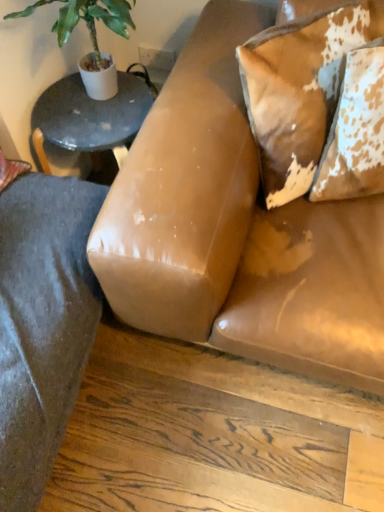
What is the approximate width of green leafy plant at upper left?

It is 15.30 inches.

Consider the image. What is the approximate width of leather couch at center?

leather couch at center is 1.00 meters wide.

This screenshot has height=512, width=384. Identify the location of speckled leather pillow at upper right, the 2th pillow viewed from the right. (297, 92).

Does speckled leather pillow at upper right, marked as the 1th pillow in a left-to-right arrangement, come in front of green leafy plant at upper left?

Yes, speckled leather pillow at upper right, marked as the 1th pillow in a left-to-right arrangement, is in front of green leafy plant at upper left.

Who is smaller, speckled leather pillow at upper right, the 2th pillow viewed from the right, or green leafy plant at upper left?

With smaller size is green leafy plant at upper left.

Is speckled leather pillow at upper right, marked as the 1th pillow in a left-to-right arrangement, oriented towards green leafy plant at upper left?

No.

From a real-world perspective, which is physically above, brown cowhide pillow at upper right, placed as the 1th pillow when sorted from right to left, or leather couch at center?

brown cowhide pillow at upper right, placed as the 1th pillow when sorted from right to left.

Can you confirm if brown cowhide pillow at upper right, arranged as the second pillow when viewed from the left, is positioned to the left of leather couch at center?

No.

In terms of width, does brown cowhide pillow at upper right, arranged as the second pillow when viewed from the left, look wider or thinner when compared to leather couch at center?

In the image, brown cowhide pillow at upper right, arranged as the second pillow when viewed from the left, appears to be more narrow than leather couch at center.

Which is behind, leather couch at center or speckled leather pillow at upper right, the 2th pillow viewed from the right?

speckled leather pillow at upper right, the 2th pillow viewed from the right.

Is speckled leather pillow at upper right, marked as the 1th pillow in a left-to-right arrangement, at the back of leather couch at center?

Absolutely, leather couch at center is directed away from speckled leather pillow at upper right, marked as the 1th pillow in a left-to-right arrangement.

From a real-world perspective, which object rests below the other?

leather couch at center is physically lower.

Who is smaller, leather couch at center or speckled leather pillow at upper right, marked as the 1th pillow in a left-to-right arrangement?

Smaller between the two is speckled leather pillow at upper right, marked as the 1th pillow in a left-to-right arrangement.

Who is more distant, green leafy plant at upper left or brown cowhide pillow at upper right, arranged as the second pillow when viewed from the left?

green leafy plant at upper left is behind.

From a real-world perspective, is green leafy plant at upper left above or below brown cowhide pillow at upper right, arranged as the second pillow when viewed from the left?

From a real-world perspective, green leafy plant at upper left is physically above brown cowhide pillow at upper right, arranged as the second pillow when viewed from the left.

Is green leafy plant at upper left far from brown cowhide pillow at upper right, placed as the 1th pillow when sorted from right to left?

No, there isn't a large distance between green leafy plant at upper left and brown cowhide pillow at upper right, placed as the 1th pillow when sorted from right to left.

Can you confirm if green leafy plant at upper left is bigger than brown cowhide pillow at upper right, placed as the 1th pillow when sorted from right to left?

Yes, green leafy plant at upper left is bigger than brown cowhide pillow at upper right, placed as the 1th pillow when sorted from right to left.

Is speckled leather pillow at upper right, the 2th pillow viewed from the right, far away from brown cowhide pillow at upper right, arranged as the second pillow when viewed from the left?

No.

From a real-world perspective, does speckled leather pillow at upper right, marked as the 1th pillow in a left-to-right arrangement, stand above brown cowhide pillow at upper right, placed as the 1th pillow when sorted from right to left?

No.

Between speckled leather pillow at upper right, marked as the 1th pillow in a left-to-right arrangement, and brown cowhide pillow at upper right, arranged as the second pillow when viewed from the left, which one has smaller width?

brown cowhide pillow at upper right, arranged as the second pillow when viewed from the left, is thinner.

Can you tell me how much speckled leather pillow at upper right, marked as the 1th pillow in a left-to-right arrangement, and brown cowhide pillow at upper right, arranged as the second pillow when viewed from the left, differ in facing direction?

The angle between the facing direction of speckled leather pillow at upper right, marked as the 1th pillow in a left-to-right arrangement, and the facing direction of brown cowhide pillow at upper right, arranged as the second pillow when viewed from the left, is 7.68 degrees.

What's the angular difference between brown cowhide pillow at upper right, placed as the 1th pillow when sorted from right to left, and green leafy plant at upper left's facing directions?

32.7 degrees.

The height and width of the screenshot is (512, 384). What are the coordinates of `houseplant behind the brown cowhide pillow at upper right, placed as the 1th pillow when sorted from right to left` in the screenshot? It's located at (90, 37).

Consider the image. Is green leafy plant at upper left a part of brown cowhide pillow at upper right, arranged as the second pillow when viewed from the left?

Actually, green leafy plant at upper left is outside brown cowhide pillow at upper right, arranged as the second pillow when viewed from the left.

Can you confirm if brown cowhide pillow at upper right, arranged as the second pillow when viewed from the left, is taller than green leafy plant at upper left?

In fact, brown cowhide pillow at upper right, arranged as the second pillow when viewed from the left, may be shorter than green leafy plant at upper left.

From the image's perspective, would you say speckled leather pillow at upper right, the 2th pillow viewed from the right, is shown under leather couch at center?

Actually, speckled leather pillow at upper right, the 2th pillow viewed from the right, appears above leather couch at center in the image.

Is speckled leather pillow at upper right, the 2th pillow viewed from the right, not within leather couch at center?

No, speckled leather pillow at upper right, the 2th pillow viewed from the right, is not entirely external to leather couch at center.

Does speckled leather pillow at upper right, the 2th pillow viewed from the right, turn towards leather couch at center?

Yes, speckled leather pillow at upper right, the 2th pillow viewed from the right, is aimed at leather couch at center.

Does speckled leather pillow at upper right, marked as the 1th pillow in a left-to-right arrangement, lie in front of leather couch at center?

No, speckled leather pillow at upper right, marked as the 1th pillow in a left-to-right arrangement, is further to the viewer.

You are a GUI agent. You are given a task and a screenshot of the screen. Output one action in this format:
    pyautogui.click(x=<x>, y=<y>)
    Task: Click on the houseplant to the left of speckled leather pillow at upper right, marked as the 1th pillow in a left-to-right arrangement
    
    Given the screenshot: What is the action you would take?
    pyautogui.click(x=90, y=37)

From the image's perspective, which pillow is the 1st one above the leather couch at center? Please provide its 2D coordinates.

[(355, 131)]

Considering their positions, is green leafy plant at upper left positioned further to leather couch at center than speckled leather pillow at upper right, marked as the 1th pillow in a left-to-right arrangement?

The object further to leather couch at center is green leafy plant at upper left.

Based on their spatial positions, is leather couch at center or speckled leather pillow at upper right, marked as the 1th pillow in a left-to-right arrangement, further from green leafy plant at upper left?

Based on the image, leather couch at center appears to be further to green leafy plant at upper left.

When comparing their distances from speckled leather pillow at upper right, the 2th pillow viewed from the right, does brown cowhide pillow at upper right, placed as the 1th pillow when sorted from right to left, or green leafy plant at upper left seem closer?

brown cowhide pillow at upper right, placed as the 1th pillow when sorted from right to left.

When comparing their distances from green leafy plant at upper left, does speckled leather pillow at upper right, marked as the 1th pillow in a left-to-right arrangement, or brown cowhide pillow at upper right, placed as the 1th pillow when sorted from right to left, seem closer?

Among the two, speckled leather pillow at upper right, marked as the 1th pillow in a left-to-right arrangement, is located nearer to green leafy plant at upper left.

Estimate the real-world distances between objects in this image. Which object is further from speckled leather pillow at upper right, marked as the 1th pillow in a left-to-right arrangement, green leafy plant at upper left or brown cowhide pillow at upper right, placed as the 1th pillow when sorted from right to left?

green leafy plant at upper left lies further to speckled leather pillow at upper right, marked as the 1th pillow in a left-to-right arrangement, than the other object.

When comparing their distances from brown cowhide pillow at upper right, placed as the 1th pillow when sorted from right to left, does green leafy plant at upper left or speckled leather pillow at upper right, marked as the 1th pillow in a left-to-right arrangement, seem closer?

speckled leather pillow at upper right, marked as the 1th pillow in a left-to-right arrangement, is closer to brown cowhide pillow at upper right, placed as the 1th pillow when sorted from right to left.

When comparing their distances from speckled leather pillow at upper right, marked as the 1th pillow in a left-to-right arrangement, does green leafy plant at upper left or leather couch at center seem closer?

leather couch at center is positioned closer to the anchor speckled leather pillow at upper right, marked as the 1th pillow in a left-to-right arrangement.

When comparing their distances from brown cowhide pillow at upper right, arranged as the second pillow when viewed from the left, does leather couch at center or green leafy plant at upper left seem further?

green leafy plant at upper left is positioned further to the anchor brown cowhide pillow at upper right, arranged as the second pillow when viewed from the left.

Find the location of a particular element. The width and height of the screenshot is (384, 512). pillow between green leafy plant at upper left and brown cowhide pillow at upper right, placed as the 1th pillow when sorted from right to left, from left to right is located at coordinates (297, 92).

At what (x,y) coordinates should I click in order to perform the action: click on studio couch between green leafy plant at upper left and speckled leather pillow at upper right, the 2th pillow viewed from the right. Please return your answer as a coordinate pair (x, y). Looking at the image, I should click on (237, 231).

Where is `studio couch between green leafy plant at upper left and brown cowhide pillow at upper right, placed as the 1th pillow when sorted from right to left, in the horizontal direction`? studio couch between green leafy plant at upper left and brown cowhide pillow at upper right, placed as the 1th pillow when sorted from right to left, in the horizontal direction is located at coordinates (237, 231).

Find the location of a particular element. Image resolution: width=384 pixels, height=512 pixels. pillow positioned between leather couch at center and speckled leather pillow at upper right, marked as the 1th pillow in a left-to-right arrangement, from near to far is located at coordinates (355, 131).